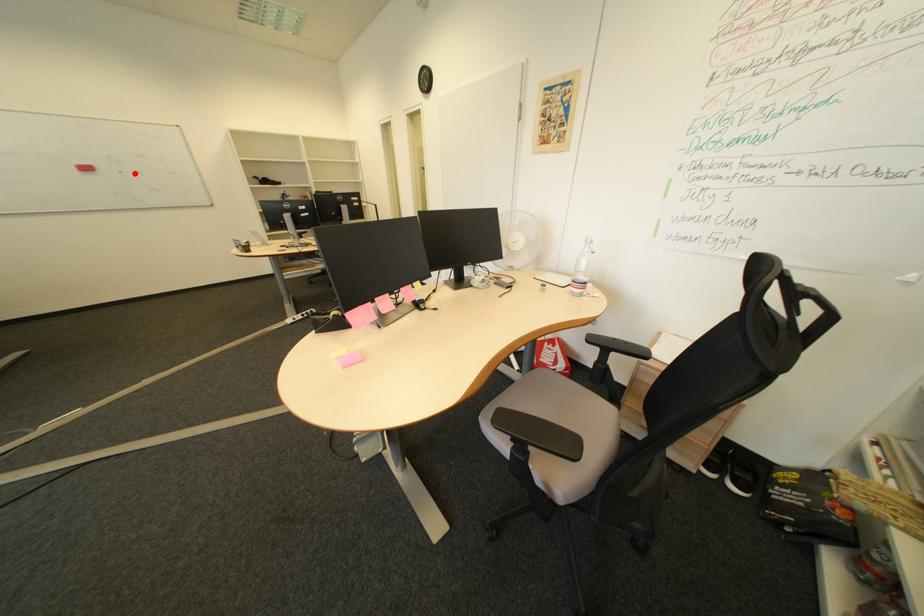
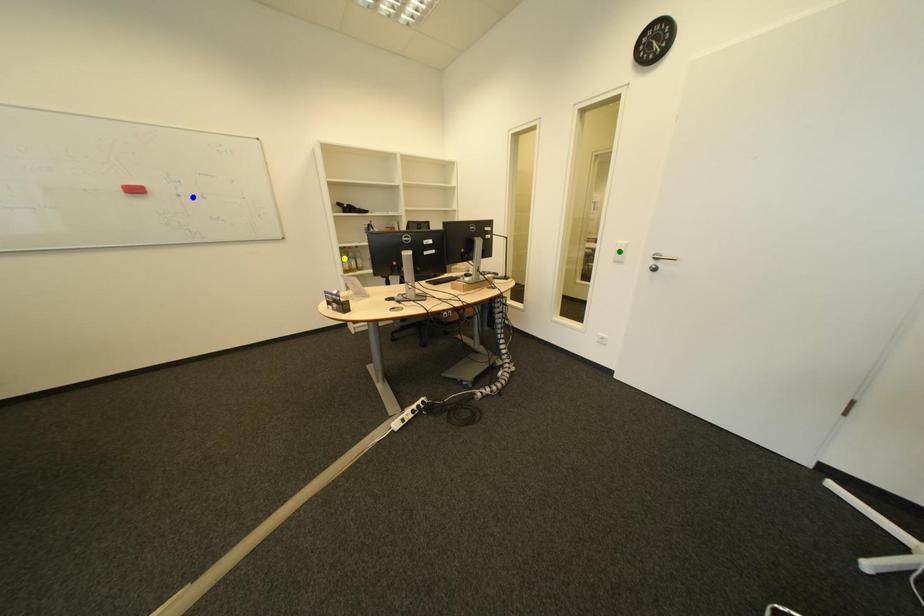
Question: I am providing you with two images of the same scene from different viewpoints. A red point is marked on the first image. You are given multiple points on the second image. Which mark in image 2 goes with the point in image 1?

Choices:
 (A) yellow point
 (B) blue point
 (C) green point

Answer: (B)